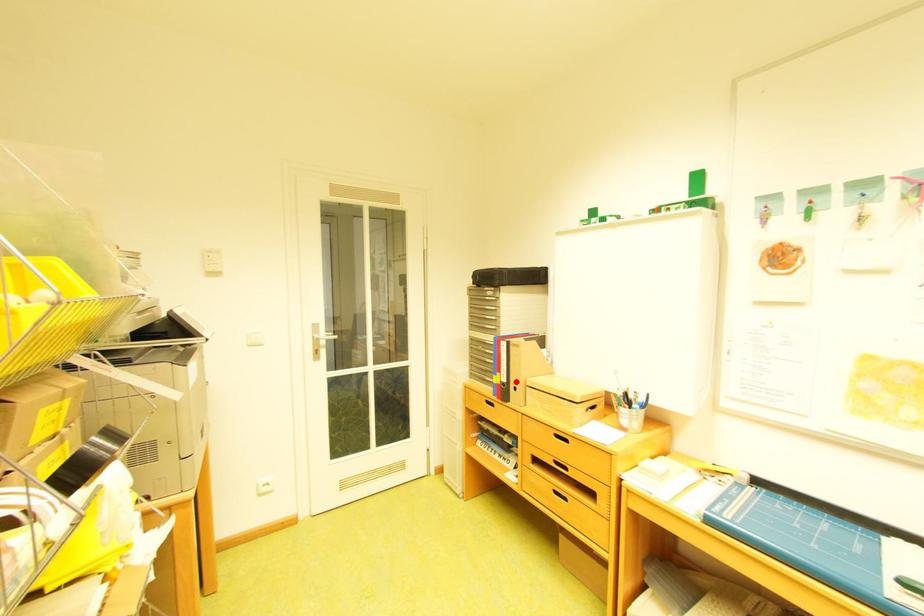
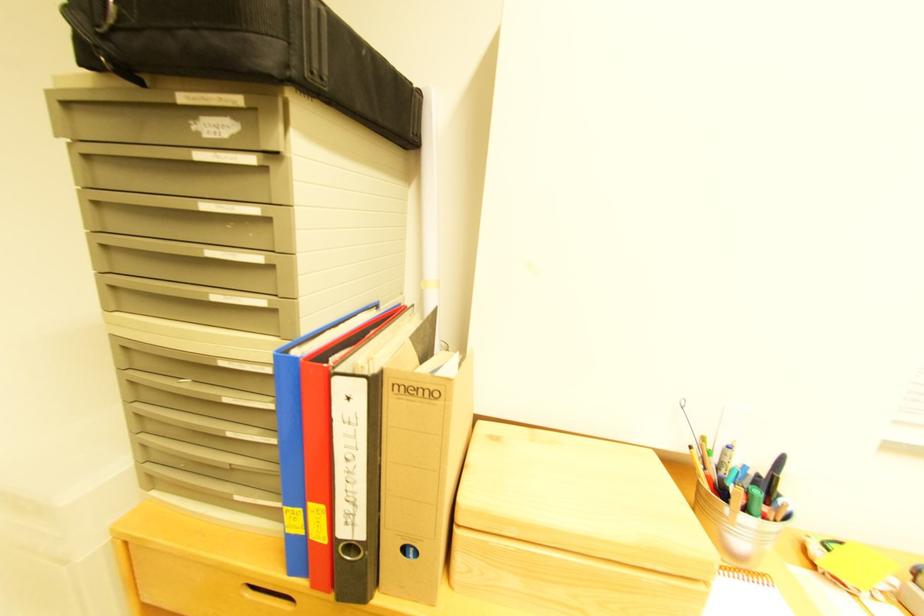
Find the pixel in the second image that matches the highlighted location in the first image.

(371, 536)